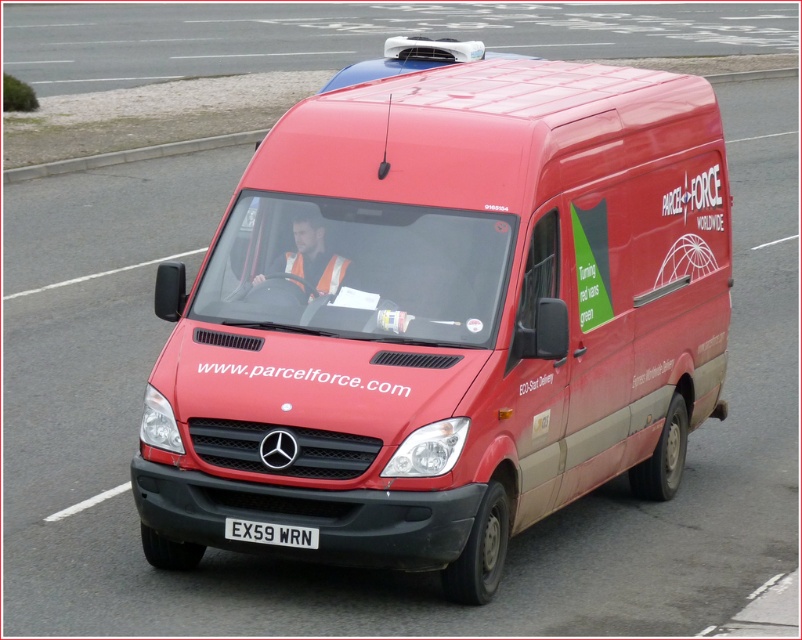
You are standing at the point marked as point (x=651, y=420). You want to take a photo of the Parcelforce van from a distance of exactly 8 meters. Is the camera at your current position the right distance away?

The distance between point (x=651, y=420) and the camera is 7.92 meters, which is slightly less than 8 meters. Therefore, you need to move back a little to achieve the desired distance of exactly 8 meters.

You are a driver who needs to check if the reflective orange vest at center is visible above the white plastic license plate at center. Based on the scene description, can you confirm if the vest is taller than the license plate?

Yes, the reflective orange vest at center is taller than the white plastic license plate at center according to the description.

From the picture: Where is the matte red van at center located in the image?

The matte red van at center is located at point coordinates of approximately 0.492 on the x axis and 0.557 on the y axis.